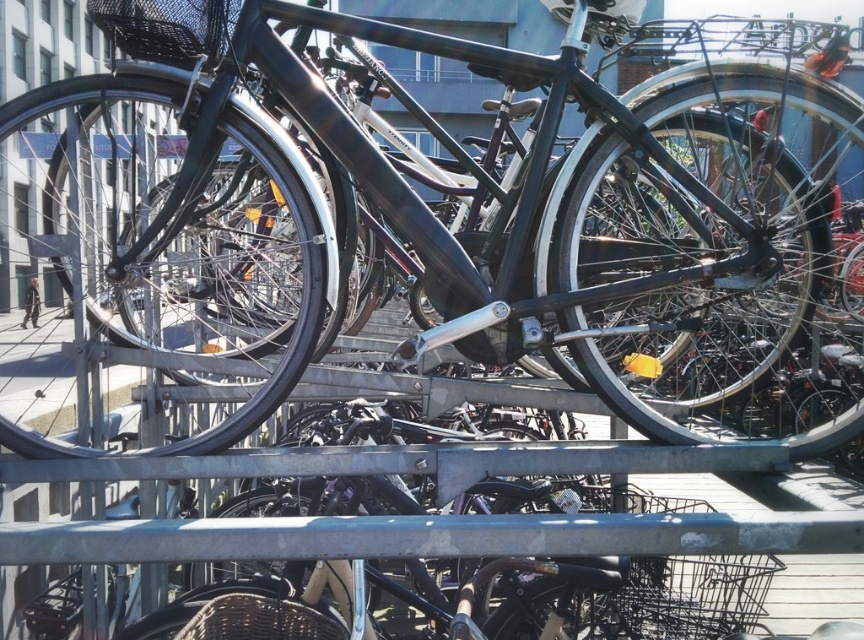
You are a delivery person trying to attach a small package to your bike. You see the glossy black bicycle at center and the black woven basket at center. Which object is wider and can accommodate the package better?

The glossy black bicycle at center is wider than the black woven basket at center, so it can accommodate the package better.

Consider the image. You are a delivery person who needs to choose between the glossy black bicycle at center and the black woven basket at center for carrying a large package. Which one can carry the package more effectively?

The glossy black bicycle at center is bigger than the black woven basket at center, so it can carry the large package more effectively.

You are a delivery person trying to find your bike. You remember your bike has a black mesh basket at upper left and a black woven basket at center. Which basket is closer to you?

The black mesh basket at upper left is closer to you because it is in front of the black woven basket at center.